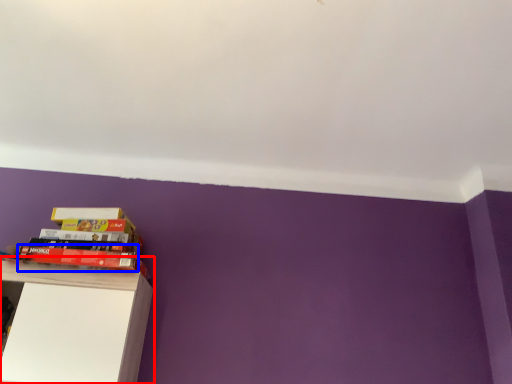
Question: Which point is further to the camera, shelf (highlighted by a red box) or paperback book (highlighted by a blue box)?

Choices:
 (A) shelf
 (B) paperback book

Answer: (B)